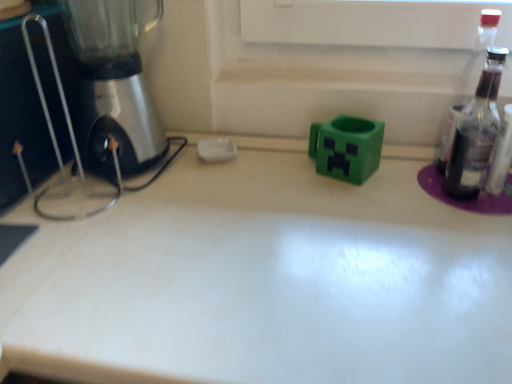
Question: In the image, is metallic silver mixer at left on the left side or the right side of transparent glass bottle at right?

Choices:
 (A) right
 (B) left

Answer: (B)

Question: Considering the positions of metallic silver mixer at left and transparent glass bottle at right in the image, is metallic silver mixer at left taller or shorter than transparent glass bottle at right?

Choices:
 (A) tall
 (B) short

Answer: (A)

Question: Which of these objects is positioned closest to the transparent glass bottle at right?

Choices:
 (A) metallic silver mixer at left
 (B) green matte plastic mug at center
 (C) white glossy countertop at center

Answer: (B)

Question: Estimate the real-world distances between objects in this image. Which object is closer to the transparent glass bottle at right?

Choices:
 (A) green matte plastic mug at center
 (B) white glossy countertop at center
 (C) metallic silver mixer at left

Answer: (A)